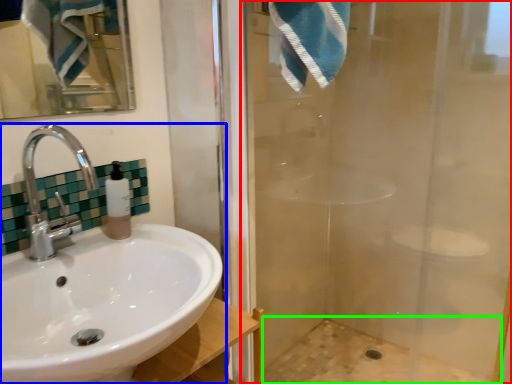
Question: Which object is the farthest from shower door (highlighted by a red box)? Choose among these: sink (highlighted by a blue box) or bath (highlighted by a green box).

Choices:
 (A) sink
 (B) bath

Answer: (A)